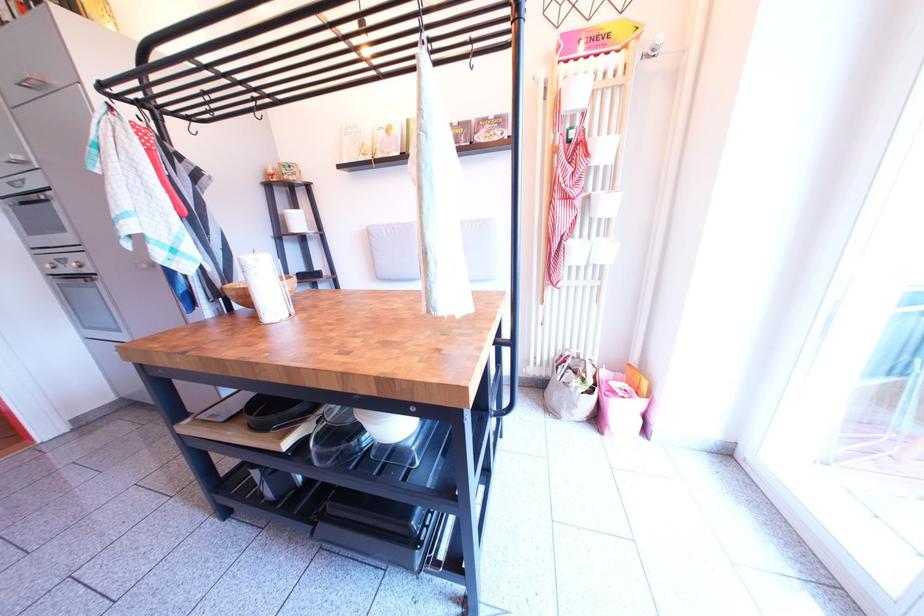
This screenshot has width=924, height=616. Find the location of `white plate`. white plate is located at coordinates (385, 424).